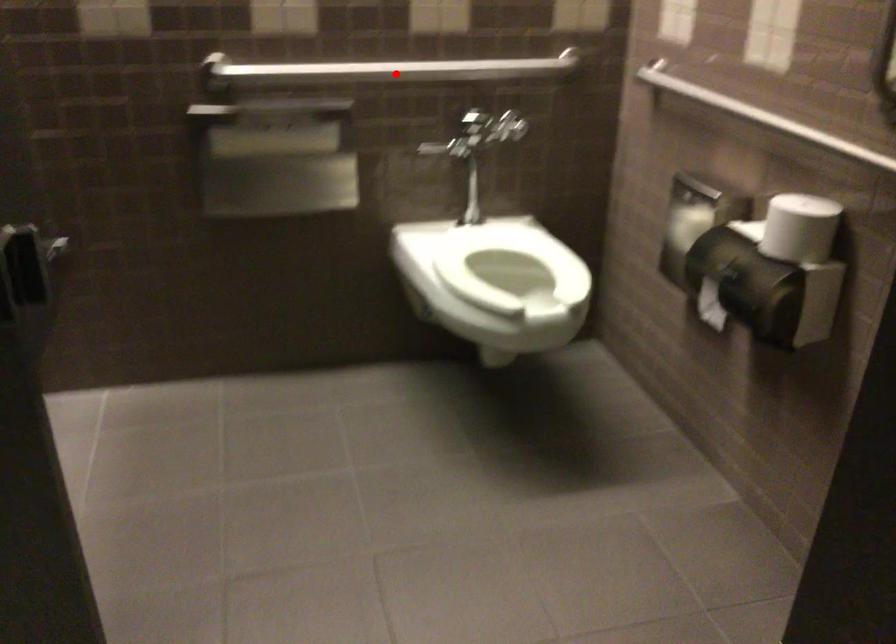
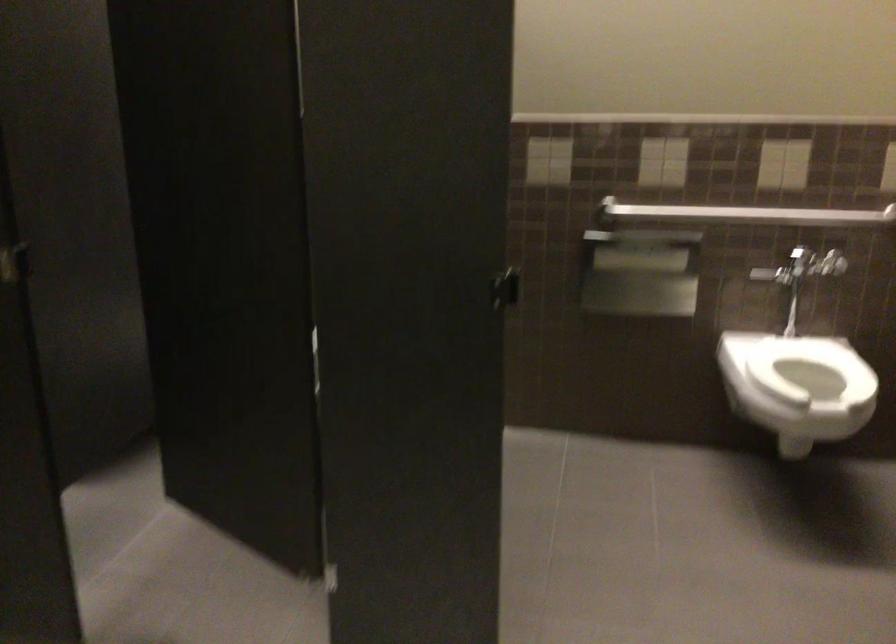
Where in the second image is the point corresponding to the highlighted location from the first image?

(745, 214)